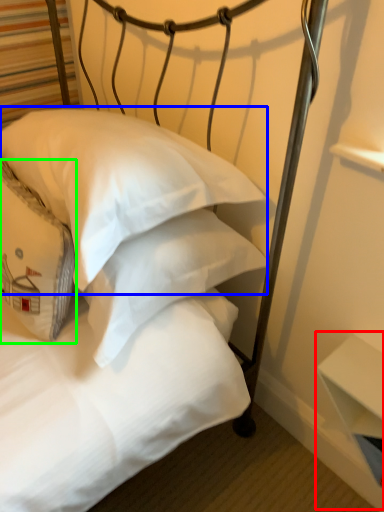
Question: Considering the real-world distances, which object is farthest from table (highlighted by a red box)? pillow (highlighted by a blue box) or pillow (highlighted by a green box)?

Choices:
 (A) pillow
 (B) pillow

Answer: (B)